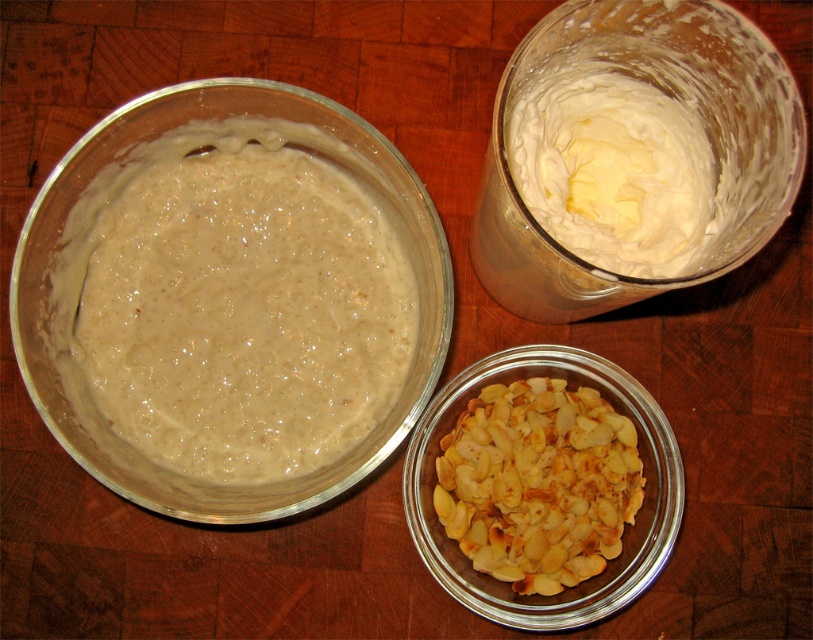
Is smooth beige batter at upper left thinner than white creamy butter at upper right?

No.

Measure the distance between point (94,321) and camera.

Point (94,321) and camera are 17.14 inches apart from each other.

This screenshot has width=813, height=640. In order to click on smooth beige batter at upper left in this screenshot , I will do `click(233, 300)`.

Can you confirm if smooth beige batter at upper left is positioned above golden toasted almonds at lower center?

Yes, smooth beige batter at upper left is above golden toasted almonds at lower center.

Does smooth beige batter at upper left lie in front of golden toasted almonds at lower center?

That is True.

Find the location of `smooth beige batter at upper left`. smooth beige batter at upper left is located at coordinates (233, 300).

Is golden toasted almonds at lower center to the left of white creamy butter at upper right from the viewer's perspective?

Indeed, golden toasted almonds at lower center is positioned on the left side of white creamy butter at upper right.

Is golden toasted almonds at lower center closer to the viewer compared to white creamy butter at upper right?

No, it is behind white creamy butter at upper right.

Between point (455, 451) and point (541, 120), which one is positioned behind?

The point (455, 451) is behind.

Identify the location of golden toasted almonds at lower center. The image size is (813, 640). (538, 483).